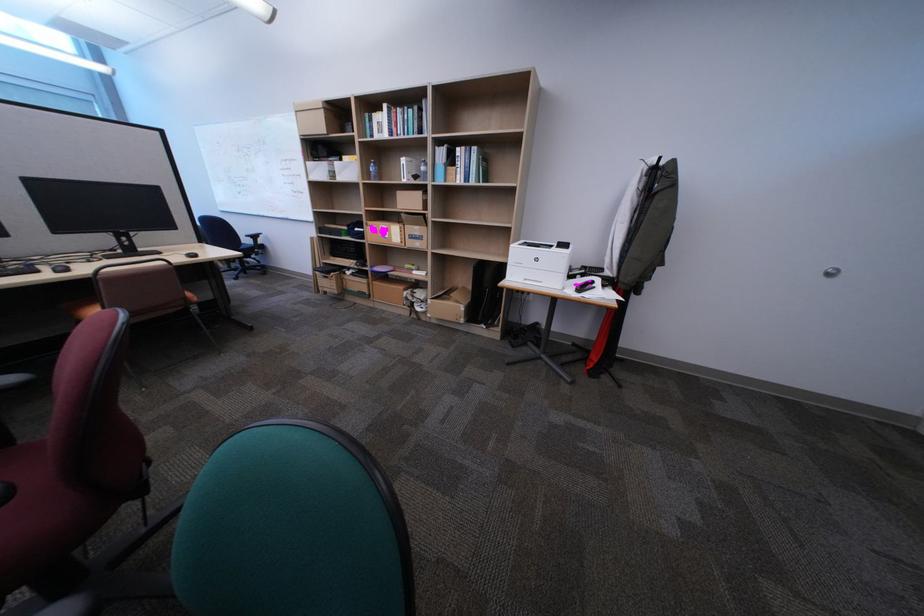
Find where to placing arm the blue chair armrest. Please return your answer as a coordinate pair (x, y).

(257, 241)